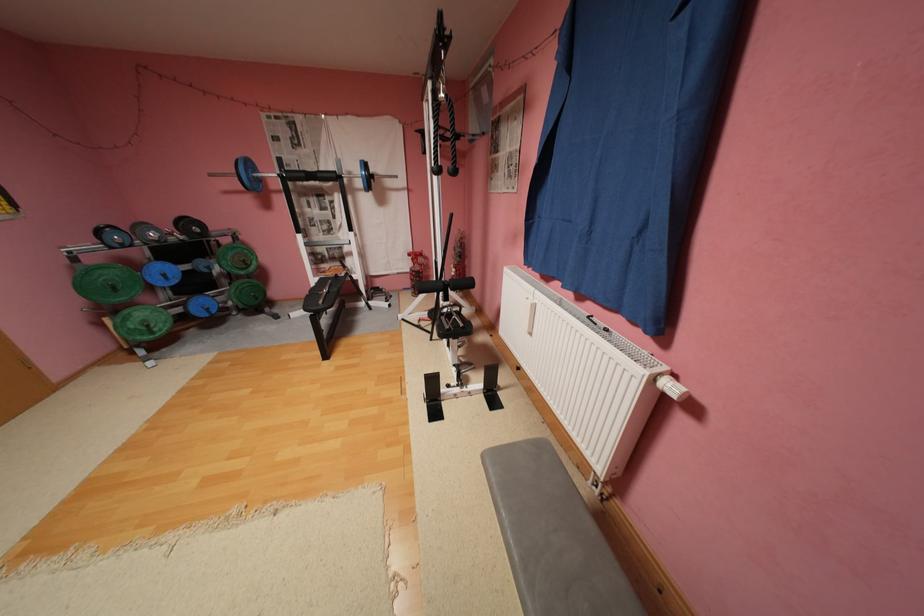
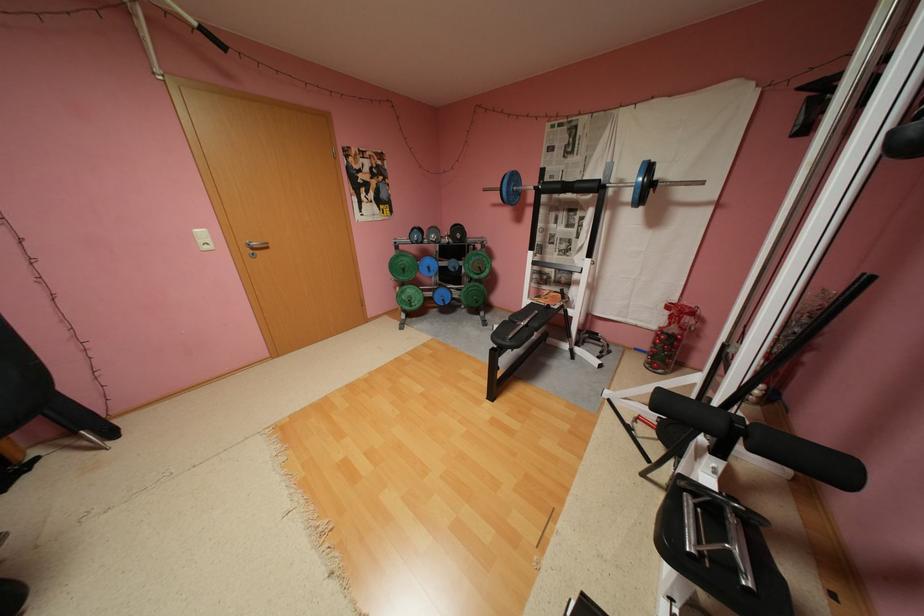
Question: I am providing you with two images of the same scene from different viewpoints. After the viewpoint changes to image2, which objects are now occluded?

Choices:
 (A) black pull-up grip
 (B) black dumbbell
 (C) blue weight plate
 (D) none of these

Answer: (D)